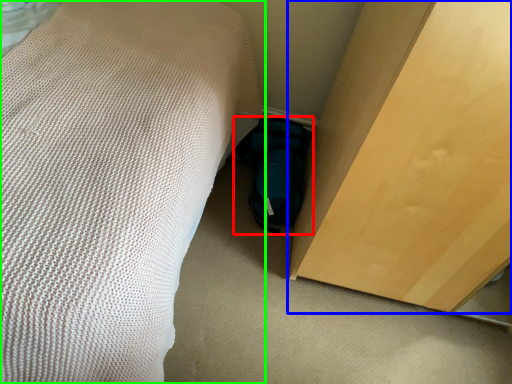
Question: Which object is positioned closest to footwear (highlighted by a red box)? Select from furniture (highlighted by a blue box) and bed (highlighted by a green box).

Choices:
 (A) furniture
 (B) bed

Answer: (A)